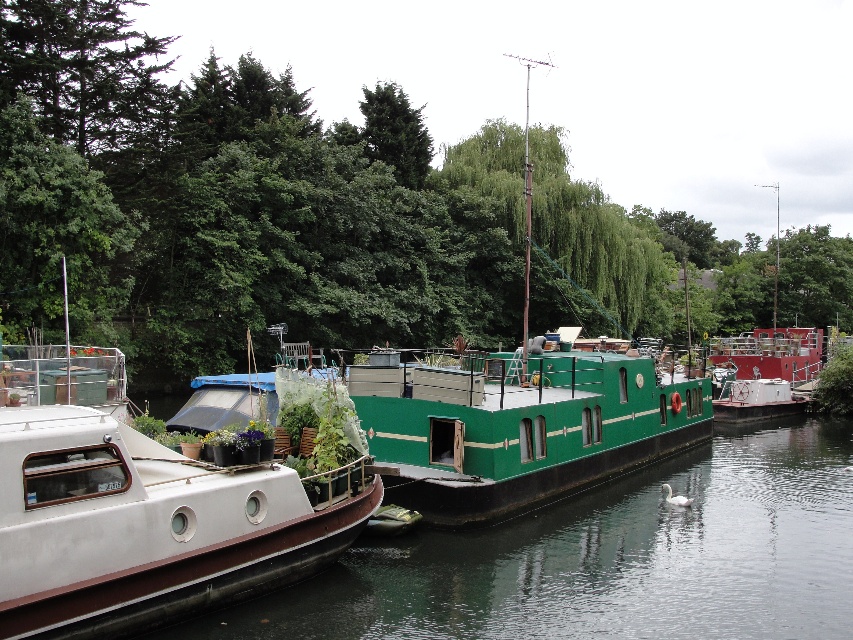
Based on the photo, you are standing on the dock and want to know which object is taller between the green leafy tree at center and the white matte boat at left. Can you tell me?

The green leafy tree at center is taller than the white matte boat at left.

You are a visitor trying to find the largest object in the canal scene. Which object is bigger between the green leafy tree at center and the white matte boat at left?

The green leafy tree at center is larger in size compared to the white matte boat at left.

You are standing on the dock and want to board the white matte boat at left. Which direction should you look to see the green leafy tree at center?

The green leafy tree at center is located above the white matte boat at left, so you should look upward to see it.